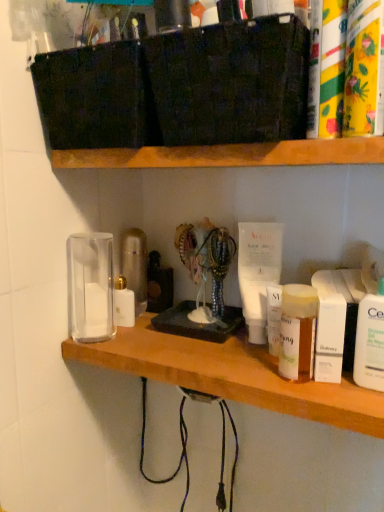
I want to click on yellow paper towel roll at upper right, the 2th toiletry viewed from the front, so click(332, 67).

Measure the distance between white matte box at right, which appears as the fourth toiletry when viewed from the left, and camera.

white matte box at right, which appears as the fourth toiletry when viewed from the left, is 21.79 inches from camera.

Find the location of a particular element. clear glass jar at center, the first shelf in the bottom-to-top sequence is located at coordinates (232, 375).

Which is correct: white matte box at right, which appears as the fourth toiletry when viewed from the left, is inside translucent plastic jar at center right, which ranks as the 5th toiletry in right-to-left order, or outside of it?

The correct answer is: outside.

From the picture: From the image's perspective, is white matte box at right, which is counted as the 3th toiletry, starting from the right, located above translucent plastic jar at center right, the second toiletry from the back?

No, from the image's perspective, white matte box at right, which is counted as the 3th toiletry, starting from the right, is not on top of translucent plastic jar at center right, the second toiletry from the back.

Does white matte box at right, which appears as the 4th toiletry when viewed from the front, have a greater height compared to translucent plastic jar at center right, the second toiletry from the back?

No, white matte box at right, which appears as the 4th toiletry when viewed from the front, is not taller than translucent plastic jar at center right, the second toiletry from the back.

Could you measure the distance between white matte box at right, acting as the third toiletry starting from the back, and translucent plastic jar at center right, the 2th toiletry when ordered from left to right?

They are 1.29 inches apart.

Is clear glass jar at center, the first shelf in the bottom-to-top sequence, turned away from wooden shelf at upper center, positioned as the first shelf in top-to-bottom order?

No, clear glass jar at center, the first shelf in the bottom-to-top sequence,'s orientation is not away from wooden shelf at upper center, positioned as the first shelf in top-to-bottom order.

Is clear glass jar at center, acting as the 2th shelf starting from the top, further to camera compared to wooden shelf at upper center, the second shelf ordered from the bottom?

Yes, it is.

From the image's perspective, is clear glass jar at center, the first shelf in the bottom-to-top sequence, below wooden shelf at upper center, positioned as the first shelf in top-to-bottom order?

Correct, clear glass jar at center, the first shelf in the bottom-to-top sequence, appears lower than wooden shelf at upper center, positioned as the first shelf in top-to-bottom order, in the image.

Image resolution: width=384 pixels, height=512 pixels. There is a clear glass jar at center, the first shelf in the bottom-to-top sequence. In order to click on shelf above it (from a real-world perspective) in this screenshot , I will do `click(228, 155)`.

From the image's perspective, between translucent plastic jar at center right, which ranks as the 5th toiletry in right-to-left order, and clear glass jar at center, acting as the 2th shelf starting from the top, which one is located above?

translucent plastic jar at center right, which ranks as the 5th toiletry in right-to-left order, is shown above in the image.

In the scene shown: Which is closer, (302, 375) or (345, 428)?

The point (302, 375) is in front.

Considering the sizes of objects translucent plastic jar at center right, the 5th toiletry positioned from the front, and clear glass jar at center, the first shelf in the bottom-to-top sequence, in the image provided, who is smaller, translucent plastic jar at center right, the 5th toiletry positioned from the front, or clear glass jar at center, the first shelf in the bottom-to-top sequence,?

translucent plastic jar at center right, the 5th toiletry positioned from the front, is smaller.

Is translucent plastic jar at center right, the 2th toiletry when ordered from left to right, at the right side of clear glass jar at center, acting as the 2th shelf starting from the top?

Yes, translucent plastic jar at center right, the 2th toiletry when ordered from left to right, is to the right of clear glass jar at center, acting as the 2th shelf starting from the top.

Does yellow paper towel roll at upper right, which is counted as the 5th toiletry, starting from the back, have a lesser height compared to floral-patterned plastic bottle at upper right, acting as the sixth toiletry starting from the back?

No.

Which toiletry is the 2nd one when counting from the right side of the yellow paper towel roll at upper right, which is counted as the 5th toiletry, starting from the back? Please provide its 2D coordinates.

[(364, 69)]

From a real-world perspective, relative to floral-patterned plastic bottle at upper right, the fifth toiletry viewed from the left, is yellow paper towel roll at upper right, the 2th toiletry viewed from the front, vertically above or below?

yellow paper towel roll at upper right, the 2th toiletry viewed from the front, is above floral-patterned plastic bottle at upper right, the fifth toiletry viewed from the left.

Looking at this image, is yellow paper towel roll at upper right, which is counted as the 5th toiletry, starting from the back, not near floral-patterned plastic bottle at upper right, acting as the sixth toiletry starting from the back?

No.

Would you say white plastic lotion at right, the third toiletry viewed from the front, is inside or outside floral-patterned plastic bottle at upper right, which is the second toiletry in right-to-left order?

white plastic lotion at right, the third toiletry viewed from the front, is spatially situated outside floral-patterned plastic bottle at upper right, which is the second toiletry in right-to-left order.

From a real-world perspective, is white plastic lotion at right, the 6th toiletry in the left-to-right sequence, physically above floral-patterned plastic bottle at upper right, acting as the sixth toiletry starting from the back?

No, from a real-world perspective, white plastic lotion at right, the 6th toiletry in the left-to-right sequence, is not over floral-patterned plastic bottle at upper right, acting as the sixth toiletry starting from the back

Considering the sizes of objects white plastic lotion at right, the third toiletry viewed from the front, and floral-patterned plastic bottle at upper right, which is the second toiletry in right-to-left order, in the image provided, who is thinner, white plastic lotion at right, the third toiletry viewed from the front, or floral-patterned plastic bottle at upper right, which is the second toiletry in right-to-left order,?

white plastic lotion at right, the third toiletry viewed from the front.

Consider the image. Is white plastic lotion at right, placed as the 4th toiletry when sorted from back to front, at the right side of floral-patterned plastic bottle at upper right, arranged as the 1th toiletry when viewed from the front?

Yes.

Considering the sizes of objects white plastic lotion at right, which ranks as the first toiletry in right-to-left order, and white glossy lotion at left, the 1th toiletry in the left-to-right sequence, in the image provided, who is thinner, white plastic lotion at right, which ranks as the first toiletry in right-to-left order, or white glossy lotion at left, the 1th toiletry in the left-to-right sequence,?

white plastic lotion at right, which ranks as the first toiletry in right-to-left order, is thinner.

Which is correct: white plastic lotion at right, which ranks as the first toiletry in right-to-left order, is inside white glossy lotion at left, the 6th toiletry when ordered from right to left, or outside of it?

white plastic lotion at right, which ranks as the first toiletry in right-to-left order, is spatially situated outside white glossy lotion at left, the 6th toiletry when ordered from right to left.

Considering the relative sizes of white plastic lotion at right, placed as the 4th toiletry when sorted from back to front, and white glossy lotion at left, the 1th toiletry in the left-to-right sequence, in the image provided, is white plastic lotion at right, placed as the 4th toiletry when sorted from back to front, bigger than white glossy lotion at left, the 1th toiletry in the left-to-right sequence,?

Incorrect, white plastic lotion at right, placed as the 4th toiletry when sorted from back to front, is not larger than white glossy lotion at left, the 1th toiletry in the left-to-right sequence.

Considering the sizes of objects white glossy lotion at left, the 1th toiletry in the left-to-right sequence, and wooden shelf at upper center, the second shelf ordered from the bottom, in the image provided, who is taller, white glossy lotion at left, the 1th toiletry in the left-to-right sequence, or wooden shelf at upper center, the second shelf ordered from the bottom,?

Standing taller between the two is white glossy lotion at left, the 1th toiletry in the left-to-right sequence.

Is white glossy lotion at left, placed as the 6th toiletry when sorted from front to back, in contact with wooden shelf at upper center, positioned as the first shelf in top-to-bottom order?

No, white glossy lotion at left, placed as the 6th toiletry when sorted from front to back, is not touching wooden shelf at upper center, positioned as the first shelf in top-to-bottom order.

Which of these two, white glossy lotion at left, which ranks as the 1th toiletry in back-to-front order, or wooden shelf at upper center, positioned as the first shelf in top-to-bottom order, is thinner?

With smaller width is white glossy lotion at left, which ranks as the 1th toiletry in back-to-front order.

Based on the photo, does white glossy lotion at left, the 1th toiletry in the left-to-right sequence, come behind wooden shelf at upper center, the second shelf ordered from the bottom?

Yes, the depth of white glossy lotion at left, the 1th toiletry in the left-to-right sequence, is greater than that of wooden shelf at upper center, the second shelf ordered from the bottom.

The image size is (384, 512). There is a white matte box at right, which appears as the fourth toiletry when viewed from the left. What are the coordinates of `the 1st toiletry above it (from the image's perspective)` in the screenshot? It's located at (297, 331).

Where is `shelf above the clear glass jar at center, the first shelf in the bottom-to-top sequence (from a real-world perspective)`? This screenshot has width=384, height=512. shelf above the clear glass jar at center, the first shelf in the bottom-to-top sequence (from a real-world perspective) is located at coordinates (228, 155).

Which object lies further to the anchor point white glossy lotion at left, the 1th toiletry in the left-to-right sequence, clear glass jar at center, acting as the 2th shelf starting from the top, or floral-patterned plastic bottle at upper right, the fifth toiletry viewed from the left?

Among the two, floral-patterned plastic bottle at upper right, the fifth toiletry viewed from the left, is located further to white glossy lotion at left, the 1th toiletry in the left-to-right sequence.

Based on their spatial positions, is clear glass jar at center, the first shelf in the bottom-to-top sequence, or yellow paper towel roll at upper right, the 2th toiletry viewed from the front, closer to white matte box at right, which appears as the 4th toiletry when viewed from the front?

clear glass jar at center, the first shelf in the bottom-to-top sequence, is closer to white matte box at right, which appears as the 4th toiletry when viewed from the front.

From the image, which object appears to be farther from white plastic lotion at right, the third toiletry viewed from the front, clear glass jar at center, acting as the 2th shelf starting from the top, or translucent plastic jar at center right, which ranks as the 5th toiletry in right-to-left order?

clear glass jar at center, acting as the 2th shelf starting from the top, is positioned further to the anchor white plastic lotion at right, the third toiletry viewed from the front.

From the image, which object appears to be farther from clear glass jar at center, acting as the 2th shelf starting from the top, white glossy lotion at left, the 6th toiletry when ordered from right to left, or wooden shelf at upper center, positioned as the first shelf in top-to-bottom order?

wooden shelf at upper center, positioned as the first shelf in top-to-bottom order, is positioned further to the anchor clear glass jar at center, acting as the 2th shelf starting from the top.

Based on the photo, estimate the real-world distances between objects in this image. Which object is further from white matte box at right, which appears as the fourth toiletry when viewed from the left, white glossy lotion at left, the 6th toiletry when ordered from right to left, or white plastic lotion at right, the third toiletry viewed from the front?

white glossy lotion at left, the 6th toiletry when ordered from right to left, is further to white matte box at right, which appears as the fourth toiletry when viewed from the left.

Estimate the real-world distances between objects in this image. Which object is further from white matte box at right, which appears as the 4th toiletry when viewed from the front, floral-patterned plastic bottle at upper right, the fifth toiletry viewed from the left, or yellow paper towel roll at upper right, positioned as the third toiletry in left-to-right order?

yellow paper towel roll at upper right, positioned as the third toiletry in left-to-right order.

When comparing their distances from floral-patterned plastic bottle at upper right, which is the second toiletry in right-to-left order, does translucent plastic jar at center right, the 2th toiletry when ordered from left to right, or clear glass jar at center, the first shelf in the bottom-to-top sequence, seem further?

The object further to floral-patterned plastic bottle at upper right, which is the second toiletry in right-to-left order, is clear glass jar at center, the first shelf in the bottom-to-top sequence.

Considering their positions, is clear glass jar at center, acting as the 2th shelf starting from the top, positioned closer to white matte box at right, which appears as the fourth toiletry when viewed from the left, than wooden shelf at upper center, positioned as the first shelf in top-to-bottom order?

clear glass jar at center, acting as the 2th shelf starting from the top.

Where is `shelf between yellow paper towel roll at upper right, the 2th toiletry viewed from the front, and translucent plastic jar at center right, the 5th toiletry positioned from the front, in the vertical direction`? The image size is (384, 512). shelf between yellow paper towel roll at upper right, the 2th toiletry viewed from the front, and translucent plastic jar at center right, the 5th toiletry positioned from the front, in the vertical direction is located at coordinates (228, 155).

Where is `shelf between yellow paper towel roll at upper right, which is counted as the 5th toiletry, starting from the back, and white plastic lotion at right, which ranks as the first toiletry in right-to-left order, in the up-down direction`? Image resolution: width=384 pixels, height=512 pixels. shelf between yellow paper towel roll at upper right, which is counted as the 5th toiletry, starting from the back, and white plastic lotion at right, which ranks as the first toiletry in right-to-left order, in the up-down direction is located at coordinates (228, 155).

Locate an element on the screen. This screenshot has height=512, width=384. shelf between floral-patterned plastic bottle at upper right, the fifth toiletry viewed from the left, and clear glass jar at center, acting as the 2th shelf starting from the top, from top to bottom is located at coordinates pos(228,155).

Identify the location of shelf between floral-patterned plastic bottle at upper right, acting as the sixth toiletry starting from the back, and white plastic lotion at right, which ranks as the first toiletry in right-to-left order, in the vertical direction. (228, 155).